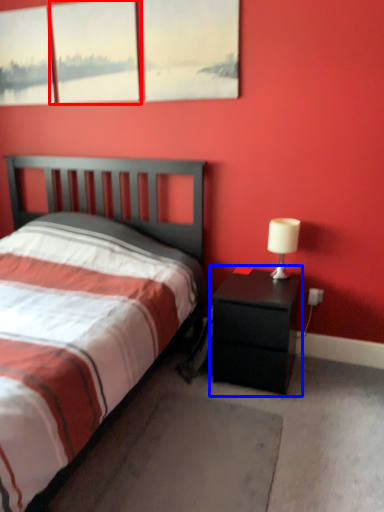
Question: Among these objects, which one is nearest to the camera, window (highlighted by a red box) or nightstand (highlighted by a blue box)?

Choices:
 (A) window
 (B) nightstand

Answer: (B)